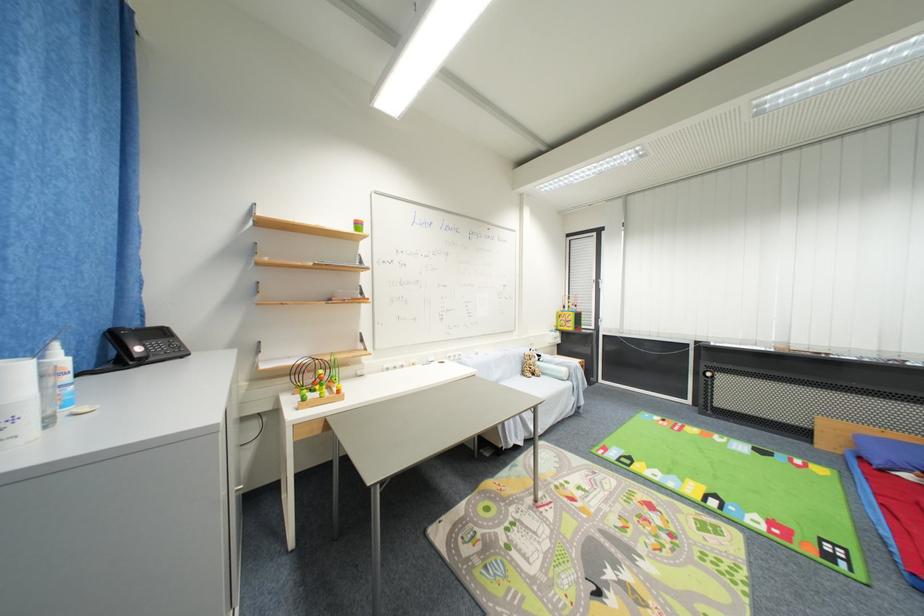
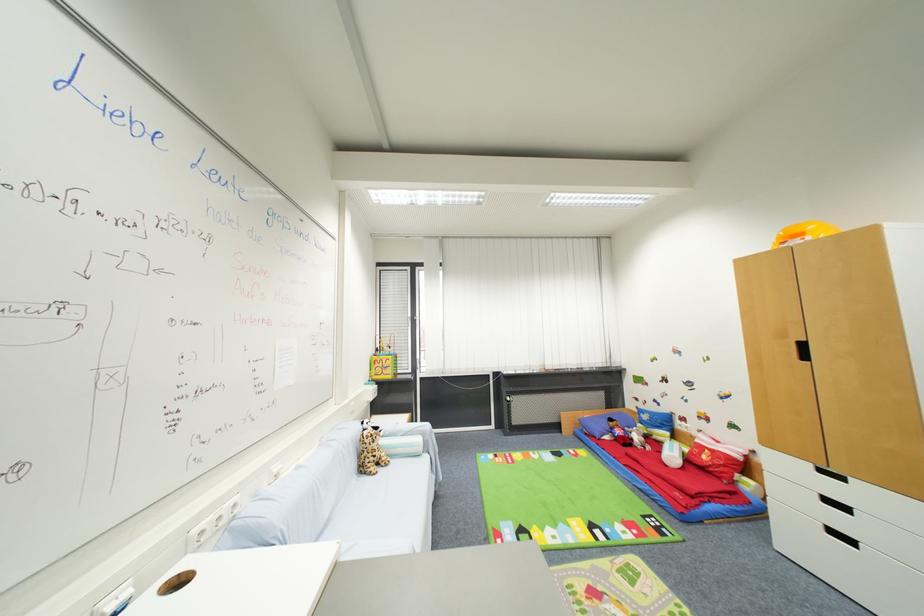
Locate, in the second image, the point that corresponds to [540,379] in the first image.

(385, 472)